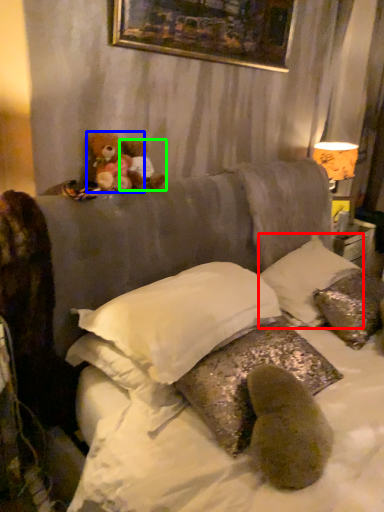
Question: Estimate the real-world distances between objects in this image. Which object is farther from pillow (highlighted by a red box), teddy bear (highlighted by a blue box) or teddy bear (highlighted by a green box)?

Choices:
 (A) teddy bear
 (B) teddy bear

Answer: (A)